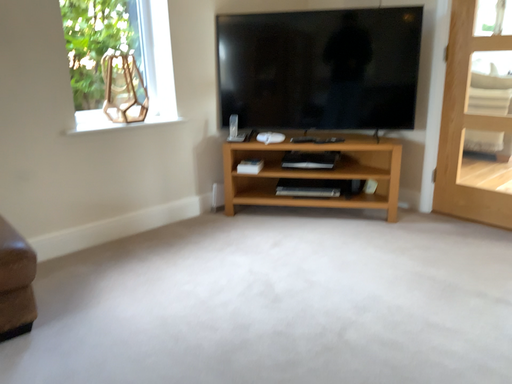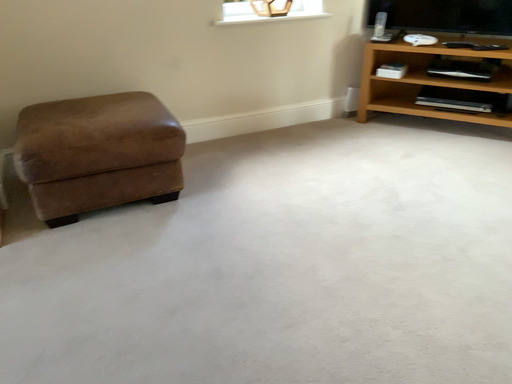
Question: Which way did the camera rotate in the video?

Choices:
 (A) rotated downward
 (B) rotated upward

Answer: (A)